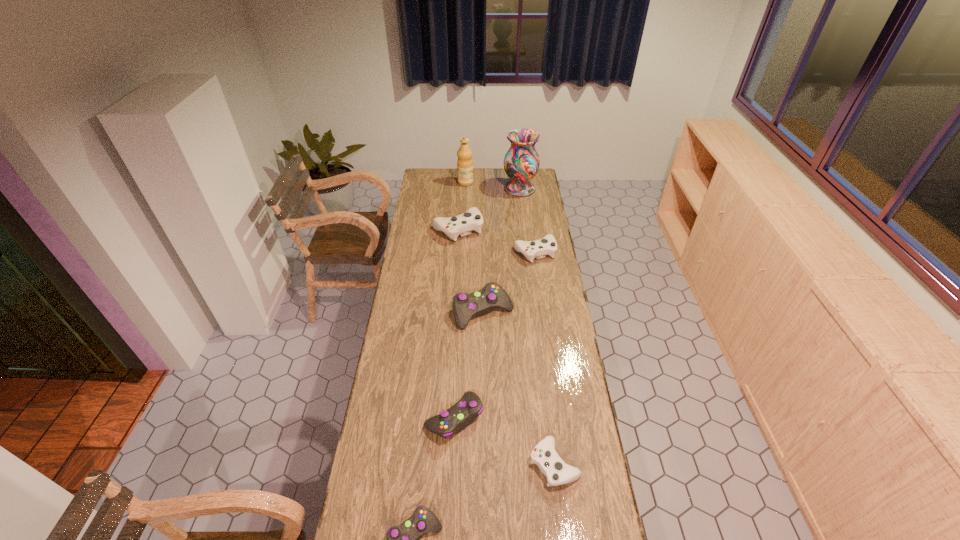
Choose which object is the seventh nearest neighbor to the vase. Please provide its 2D coordinates. Your answer should be formatted as a tuple, i.e. [(x, y)], where the tuple contains the x and y coordinates of a point satisfying the conditions above.

[(403, 539)]

Identify which control is the second nearest to the second smallest white control. Please provide its 2D coordinates. Your answer should be formatted as a tuple, i.e. [(x, y)], where the tuple contains the x and y coordinates of a point satisfying the conditions above.

[(465, 306)]

Image resolution: width=960 pixels, height=540 pixels. Find the location of `control that is the second nearest to the smallest white control`. control that is the second nearest to the smallest white control is located at coordinates (403, 539).

Locate which white control is the closest to the second biggest white control. Please provide its 2D coordinates. Your answer should be formatted as a tuple, i.e. [(x, y)], where the tuple contains the x and y coordinates of a point satisfying the conditions above.

[(463, 224)]

Locate an element on the screen. The image size is (960, 540). white control that is the closest to the biggest white control is located at coordinates (547, 245).

Identify which gray control is the second closest to the smallest gray control. Please provide its 2D coordinates. Your answer should be formatted as a tuple, i.e. [(x, y)], where the tuple contains the x and y coordinates of a point satisfying the conditions above.

[(465, 306)]

Select which gray control is the second closest to the farthest gray control. Please provide its 2D coordinates. Your answer should be formatted as a tuple, i.e. [(x, y)], where the tuple contains the x and y coordinates of a point satisfying the conditions above.

[(403, 539)]

This screenshot has height=540, width=960. Find the location of `vacant point that satisfies the following two spatial constraints: 1. on the front side of the second biggest white control; 2. on the right side of the vase`. vacant point that satisfies the following two spatial constraints: 1. on the front side of the second biggest white control; 2. on the right side of the vase is located at coordinates (528, 252).

I want to click on vacant position in the image that satisfies the following two spatial constraints: 1. on the back side of the second biggest white control; 2. on the label of the olive oil, so click(x=525, y=183).

In order to click on vacant position in the image that satisfies the following two spatial constraints: 1. on the label of the tallest object; 2. on the left side of the second tallest object in this screenshot , I will do `click(466, 189)`.